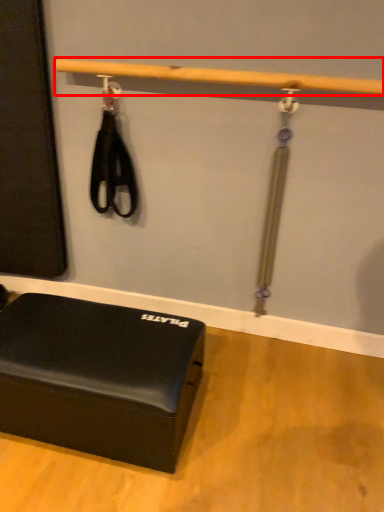
Question: From the image's perspective, considering the relative positions of beam (annotated by the red box) and furniture in the image provided, where is beam (annotated by the red box) located with respect to the staircase?

Choices:
 (A) below
 (B) above

Answer: (B)